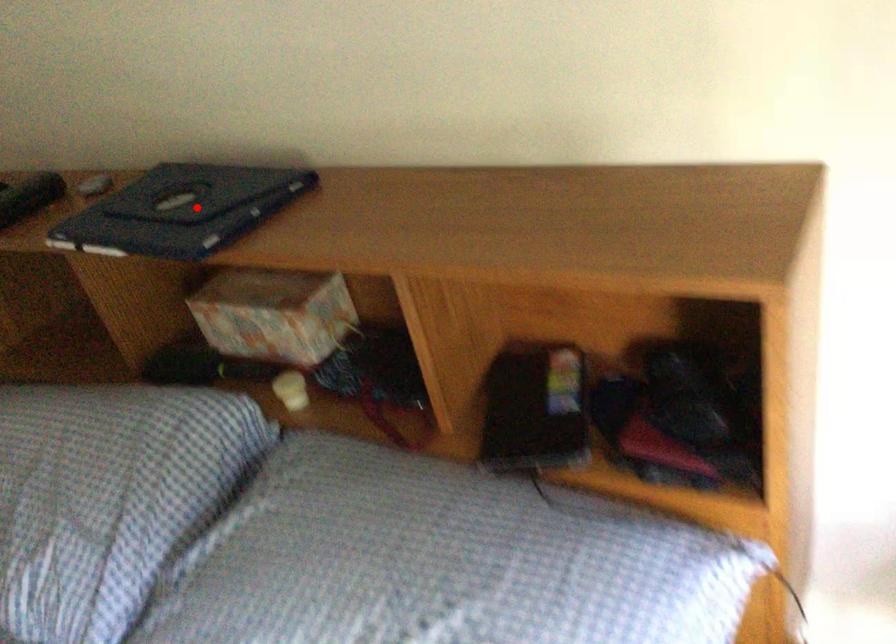
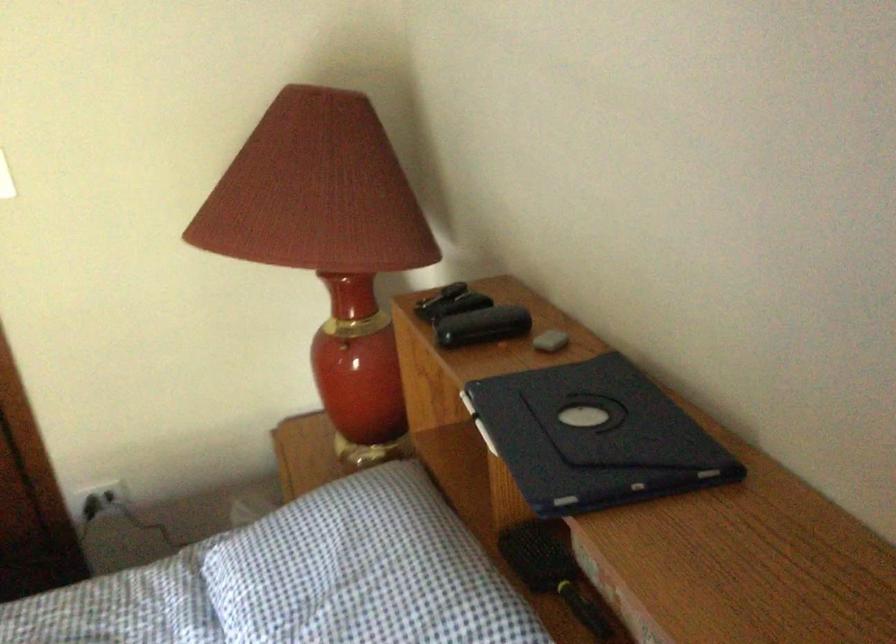
Question: I am providing you with two images of the same scene from different viewpoints. Given a red point in image1, look at the same physical point in image2. Is it:

Choices:
 (A) Closer to the viewpoint
 (B) Farther from the viewpoint

Answer: (A)